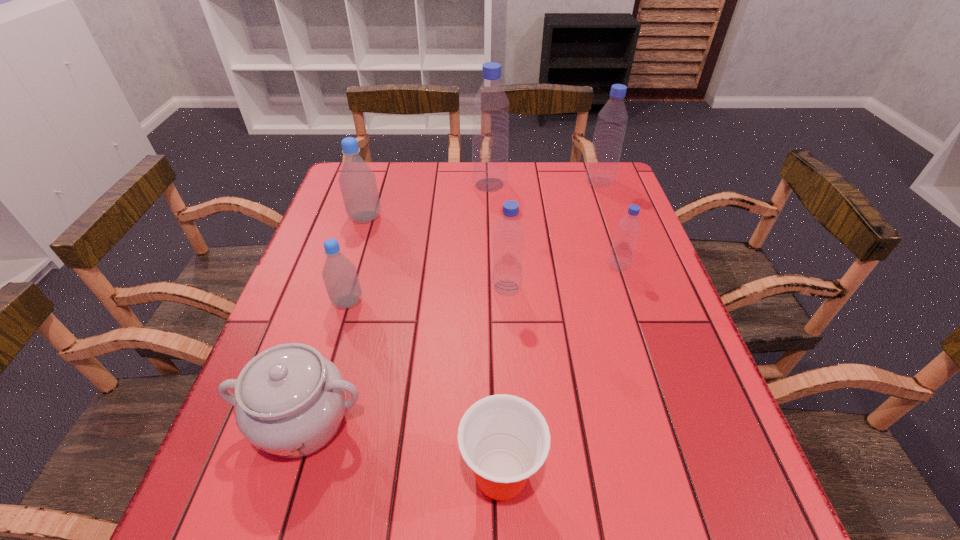
Image resolution: width=960 pixels, height=540 pixels. In order to click on blank region between the tallest object and the red cup in this screenshot , I will do `click(495, 330)`.

At what (x,y) coordinates should I click in order to perform the action: click on free area in between the cup and the third biggest blue bottle. Please return your answer as a coordinate pair (x, y). Looking at the image, I should click on (504, 382).

Where is `vacant region between the tallest object and the red cup`? This screenshot has width=960, height=540. vacant region between the tallest object and the red cup is located at coordinates (495, 330).

Where is `free space between the white chinaware and the fifth shortest bottle`? The width and height of the screenshot is (960, 540). free space between the white chinaware and the fifth shortest bottle is located at coordinates (451, 302).

This screenshot has height=540, width=960. Identify the location of vacant space that's between the biggest blue bottle and the nearer gray bottle. (419, 243).

Find the location of a particular element. vacant space in between the nearer gray bottle and the fourth nearest bottle is located at coordinates (356, 259).

Find the location of `free space that is in between the second smallest blue bottle and the chinaware`. free space that is in between the second smallest blue bottle and the chinaware is located at coordinates (405, 354).

Identify the location of free space between the second smallest blue bottle and the shortest object. The width and height of the screenshot is (960, 540). (504, 382).

The width and height of the screenshot is (960, 540). Identify the location of vacant area between the shortest object and the smaller gray bottle. (424, 388).

This screenshot has height=540, width=960. What are the coordinates of `the third closest object to the cup` in the screenshot? It's located at (339, 274).